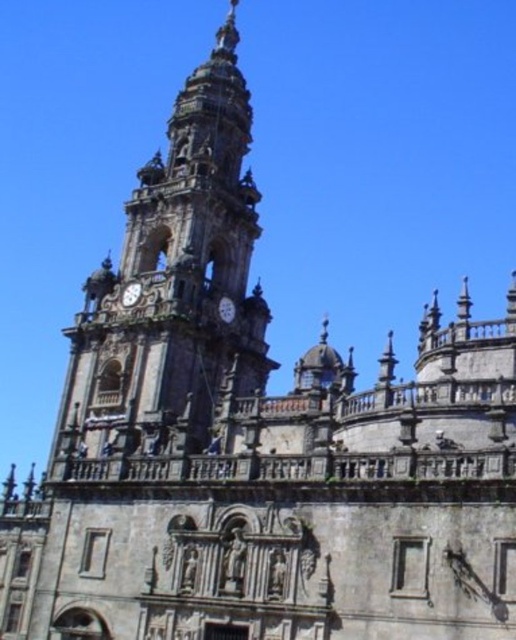
You are standing in front of the historic building and notice a point marked at coordinates (171, 292). Which architectural feature of the building does this point correspond to?

The point at coordinates (171, 292) corresponds to the stone clock tower at center.

You are standing in front of the cathedral and notice two points marked on the facade. The first point is at coordinates point (228,61) and the second is at point (221,296). Which of these points is closer to your current position?

Point (228,61) is closer to your current position because it is further to the viewer than point (221,296).

You are an architect examining the cathedral facade. You notice two clocks on the tower. Which clock is placed higher up, the silver metallic clock at center or the matte gray clock at center?

The silver metallic clock at center is positioned over the matte gray clock at center, so it is placed higher up.